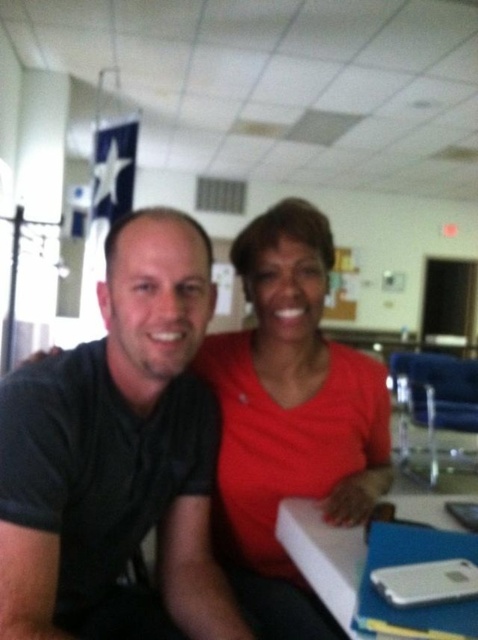
Question: Which point is farther to the camera?

Choices:
 (A) (193, 412)
 (B) (366, 636)

Answer: (A)

Question: Which point is farther to the camera?

Choices:
 (A) white plastic table at lower center
 (B) matte red shirt at center

Answer: (B)

Question: Is black matte shirt at center smaller than matte red shirt at center?

Choices:
 (A) yes
 (B) no

Answer: (B)

Question: Does black matte shirt at center have a smaller size compared to matte red shirt at center?

Choices:
 (A) yes
 (B) no

Answer: (B)

Question: Which point is farther to the camera?

Choices:
 (A) white plastic table at lower center
 (B) matte red shirt at center
 (C) black matte shirt at center

Answer: (B)

Question: Can you confirm if black matte shirt at center is bigger than matte red shirt at center?

Choices:
 (A) yes
 (B) no

Answer: (A)